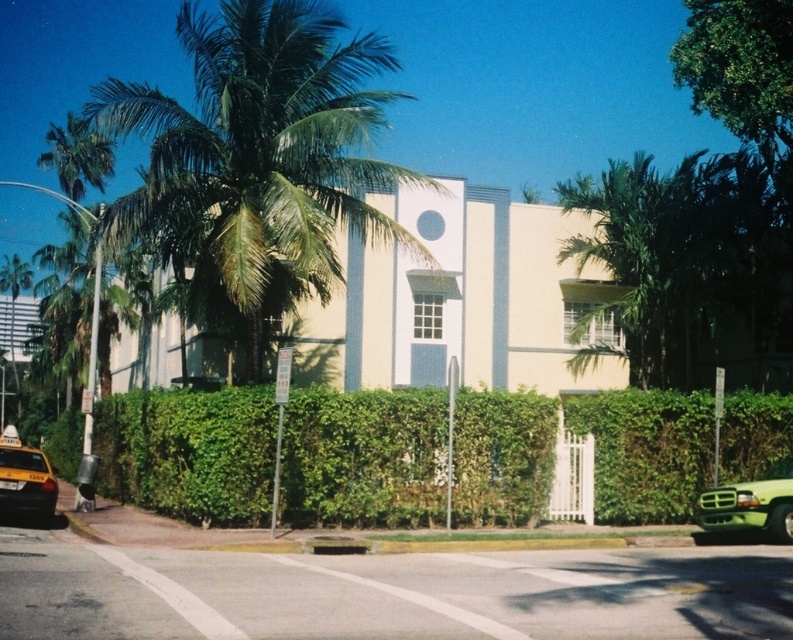
Can you confirm if green leafy palm tree at upper left is positioned below green leafy palm tree at right?

No, green leafy palm tree at upper left is not below green leafy palm tree at right.

Where is `green leafy palm tree at upper left`? The height and width of the screenshot is (640, 793). green leafy palm tree at upper left is located at coordinates (257, 161).

Locate an element on the screen. This screenshot has width=793, height=640. green leafy palm tree at upper left is located at coordinates (257, 161).

Who is more distant from viewer, (504, 432) or (638, 241)?

The point (638, 241) is behind.

The image size is (793, 640). I want to click on green leafy hedge at center, so click(362, 458).

Which is behind, point (117, 401) or point (667, 180)?

Positioned behind is point (667, 180).

Identify the location of green leafy hedge at center. (362, 458).

Is green leafy hedge at center thinner than green leafy palm tree at upper left?

Indeed, green leafy hedge at center has a lesser width compared to green leafy palm tree at upper left.

Does green leafy hedge at center have a greater height compared to green leafy palm tree at upper left?

In fact, green leafy hedge at center may be shorter than green leafy palm tree at upper left.

Find the location of a particular element. The height and width of the screenshot is (640, 793). green leafy hedge at center is located at coordinates (362, 458).

At what (x,y) coordinates should I click in order to perform the action: click on green leafy hedge at center. Please return your answer as a coordinate pair (x, y). The width and height of the screenshot is (793, 640). Looking at the image, I should click on (362, 458).